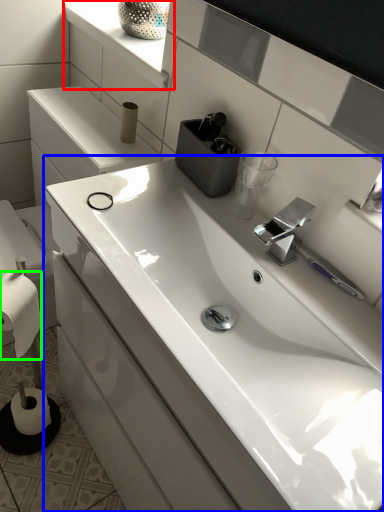
Question: Which is nearer to the window sill (highlighted by a red box)? sink (highlighted by a blue box) or toilet paper (highlighted by a green box).

Choices:
 (A) sink
 (B) toilet paper

Answer: (A)